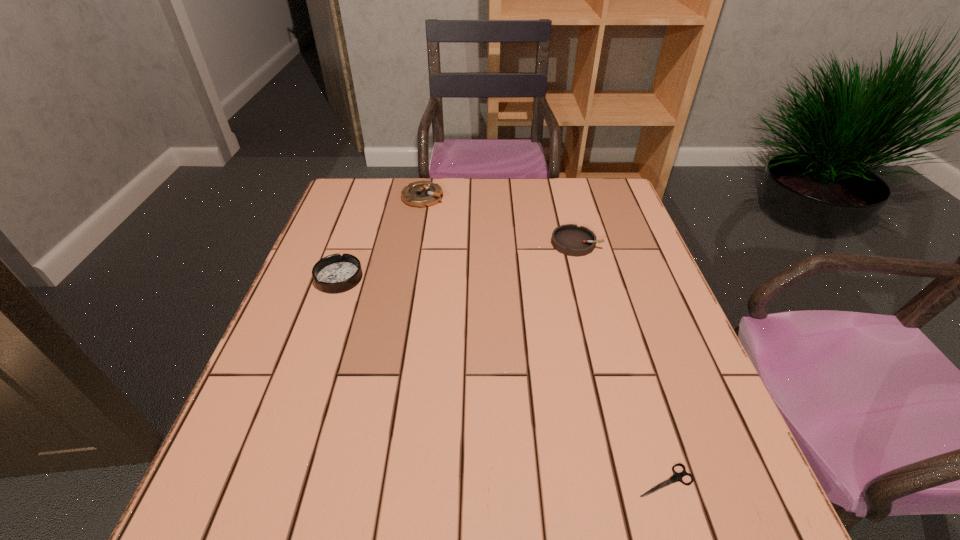
You are a GUI agent. You are given a task and a screenshot of the screen. Output one action in this format:
    pyautogui.click(x=<x>, y=<y>)
    Task: Click on the vacant region located on the back of the leftmost object
    The height and width of the screenshot is (540, 960).
    Given the screenshot: What is the action you would take?
    371,188

This screenshot has width=960, height=540. Identify the location of vacant space located 0.130m on the back of the shortest object. 639,397.

Locate an element on the screen. The image size is (960, 540). object that is at the far edge is located at coordinates (420, 194).

This screenshot has width=960, height=540. What are the coordinates of `object located in the near edge section of the desktop` in the screenshot? It's located at (676, 476).

Locate an element on the screen. The width and height of the screenshot is (960, 540). object positioned at the left edge is located at coordinates (335, 273).

In order to click on ashtray situated at the right edge in this screenshot , I will do `click(569, 239)`.

This screenshot has width=960, height=540. In order to click on shears that is at the right edge in this screenshot , I will do `click(676, 476)`.

This screenshot has width=960, height=540. I want to click on object that is at the near right corner, so [676, 476].

You are a GUI agent. You are given a task and a screenshot of the screen. Output one action in this format:
    pyautogui.click(x=<x>, y=<y>)
    Task: Click on the vacant area at the far edge
    Image resolution: width=960 pixels, height=540 pixels.
    Given the screenshot: What is the action you would take?
    pyautogui.click(x=552, y=206)

Where is `free location at the left edge of the desktop`? The height and width of the screenshot is (540, 960). free location at the left edge of the desktop is located at coordinates (341, 227).